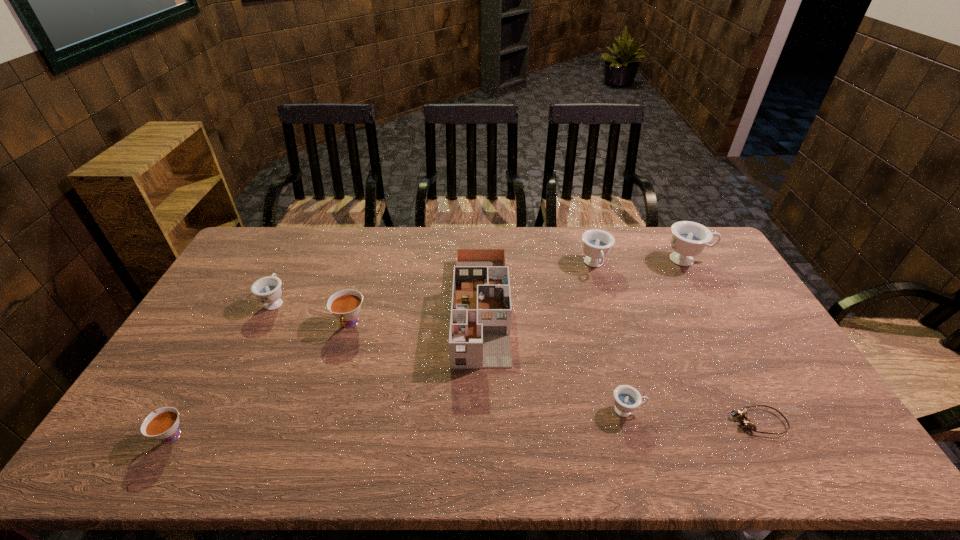
Locate an element on the screen. free space between the rightmost teacup and the second biggest blue teacup is located at coordinates (641, 262).

Find the location of `free space between the tallest teacup and the fifth object from right to left`. free space between the tallest teacup and the fifth object from right to left is located at coordinates (585, 284).

The height and width of the screenshot is (540, 960). In order to click on empty space that is in between the fourth object from left to right and the rightmost blue teacup in this screenshot , I will do `click(585, 284)`.

Find the location of a particular element. This screenshot has height=540, width=960. free space between the third smallest blue teacup and the dollhouse is located at coordinates (538, 286).

The height and width of the screenshot is (540, 960). I want to click on unoccupied area between the shortest object and the fifth object from right to left, so click(x=620, y=364).

This screenshot has height=540, width=960. Identify the location of free space between the fifth object from right to left and the smaller white teacup. click(x=325, y=372).

You are a GUI agent. You are given a task and a screenshot of the screen. Output one action in this format:
    pyautogui.click(x=<x>, y=<y>)
    Task: Click on the free space between the rightmost blue teacup and the leftmost teacup
    
    Given the screenshot: What is the action you would take?
    pyautogui.click(x=429, y=348)

At what (x,y) coordinates should I click in order to perform the action: click on vacant region between the white dollhouse and the smallest blue teacup. Please return your answer as a coordinate pair (x, y). This screenshot has width=960, height=540. Looking at the image, I should click on (554, 359).

The image size is (960, 540). I want to click on object that ranks as the fourth closest to the smaller white teacup, so click(x=626, y=398).

Locate which object is the second closest to the white dollhouse. Please provide its 2D coordinates. Your answer should be formatted as a tuple, i.e. [(x, y)], where the tuple contains the x and y coordinates of a point satisfying the conditions above.

[(597, 243)]